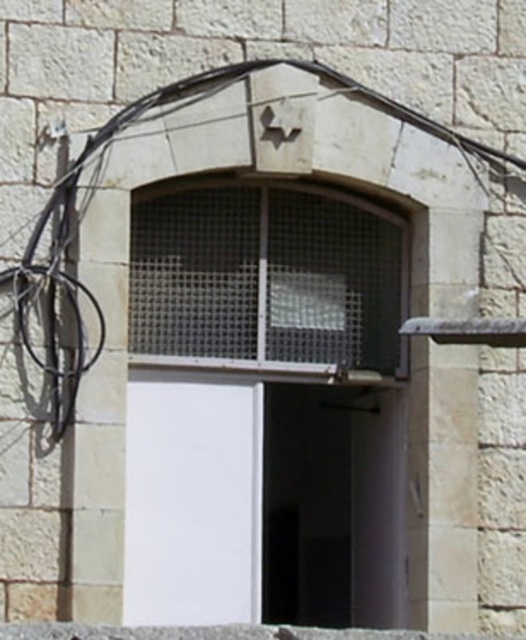
You are a maintenance worker needing to reach both the metal mesh window at center and the black rubber wire at upper left. Given that your ladder can extend up to 3.5 feet, can you safely reach both objects without moving the ladder?

The distance between the metal mesh window at center and the black rubber wire at upper left is 4.03 feet, which exceeds the ladder extension limit of 3.5 feet. Therefore, you cannot safely reach both objects without moving the ladder.

You are standing in front of the stone wall with the arched doorway. There are two points marked on the wall. The first point is at coordinates point (x=25, y=337) and the second is at point (x=412, y=637). If you were to touch both points with your hand, which point would you reach first?

Point (x=25, y=337) is further to the viewer than point (x=412, y=637), so you would reach point (x=25, y=337) first.